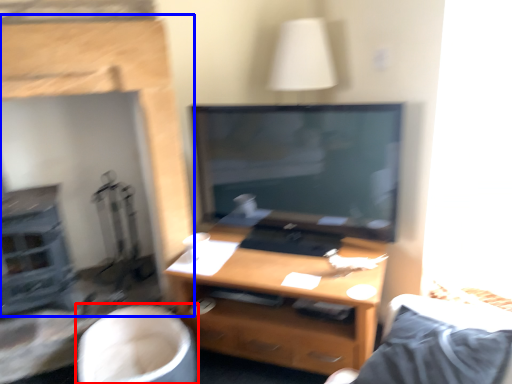
Question: Which object is closer to the camera taking this photo, swivel chair (highlighted by a red box) or fireplace (highlighted by a blue box)?

Choices:
 (A) swivel chair
 (B) fireplace

Answer: (B)